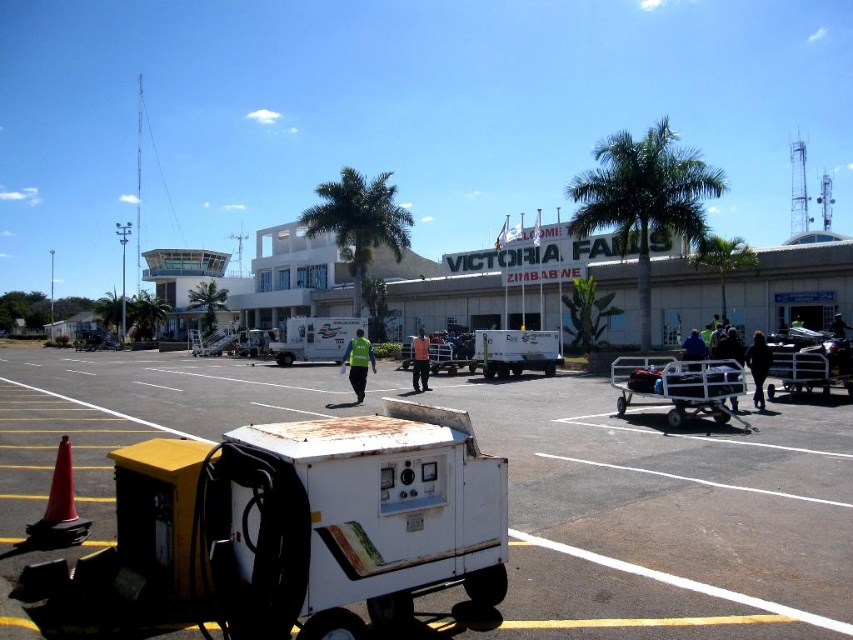
You are standing on the airport tarmac and see two points marked on the ground. The first point is at coordinate point (x=606, y=534) and the second is at coordinate point (x=486, y=374). Which point is closer to your current position?

Point (x=606, y=534) is closer to the camera than point (x=486, y=374), so the first point is closer to your current position.

You are a passenger trying to locate your luggage cart on the tarmac. You see both the metallic luggage cart at center and the yellow reflective vest at center. Which object is nearer to you?

The metallic luggage cart at center is closer to the viewer than the yellow reflective vest at center.